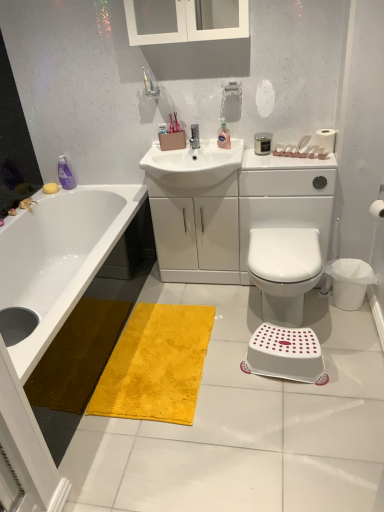
The width and height of the screenshot is (384, 512). Find the location of `free spot above yellow plush rug at center (from a real-world perspective)`. free spot above yellow plush rug at center (from a real-world perspective) is located at coordinates (164, 355).